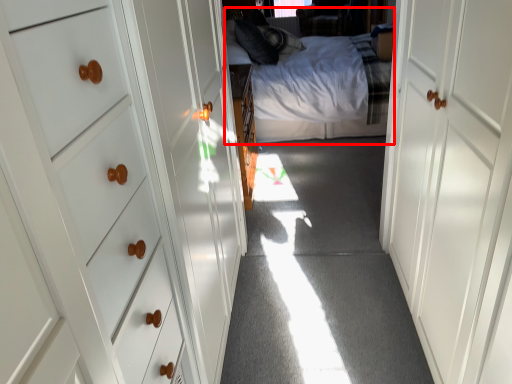
Question: Considering the relative positions of bed (annotated by the red box) and door in the image provided, where is bed (annotated by the red box) located with respect to the staircase?

Choices:
 (A) right
 (B) left

Answer: (B)